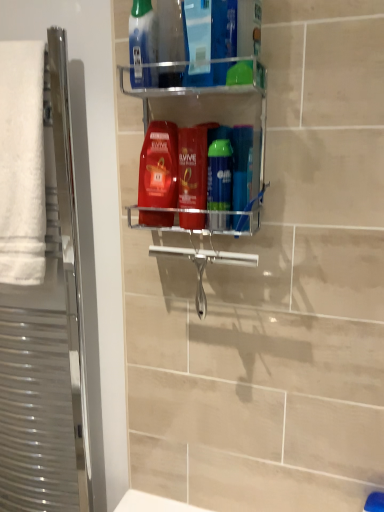
I want to click on silver metallic towel rack at left, so click(x=39, y=283).

Describe the element at coordinates (143, 44) in the screenshot. The image size is (384, 512). I see `translucent plastic mouthwash at upper center, marked as the 4th mouthwash in a right-to-left arrangement` at that location.

Identify the location of shiny red shampoo at center. The height and width of the screenshot is (512, 384). [x=159, y=166].

At what (x,y) coordinates should I click in order to perform the action: click on clear plastic shelf at center. Please return your answer as a coordinate pair (x, y). The height and width of the screenshot is (512, 384). Looking at the image, I should click on (207, 110).

Find the location of `silver metallic towel rack at left`. silver metallic towel rack at left is located at coordinates (39, 283).

Image resolution: width=384 pixels, height=512 pixels. What are the coordinates of `mouthwash that is the 2nd one when counting forward from the shiny red shampoo at center` in the screenshot? It's located at (219, 175).

Can you confirm if shiny red shampoo at center is positioned to the right of green glossy mouthwash at center, which appears as the 2th mouthwash when viewed from the right?

No, shiny red shampoo at center is not to the right of green glossy mouthwash at center, which appears as the 2th mouthwash when viewed from the right.

Is point (170, 206) closer to camera compared to point (230, 156)?

No.

At what (x,y) coordinates should I click in order to perform the action: click on shelf that appears above the shiny red shampoo at center (from the image's perspective). Please return your answer as a coordinate pair (x, y). The width and height of the screenshot is (384, 512). Looking at the image, I should click on (207, 110).

From a real-world perspective, is clear plastic shelf at center above or below shiny red shampoo at center?

clear plastic shelf at center is situated higher than shiny red shampoo at center in the real world.

Considering the sizes of objects clear plastic shelf at center and shiny red shampoo at center in the image provided, who is bigger, clear plastic shelf at center or shiny red shampoo at center?

clear plastic shelf at center.

Visually, is clear plastic shelf at center positioned to the left or to the right of shiny red shampoo at center?

Clearly, clear plastic shelf at center is on the right of shiny red shampoo at center in the image.

Is white soft towel at left inside or outside of clear plastic shelf at center?

white soft towel at left is spatially situated outside clear plastic shelf at center.

Consider the image. From a real-world perspective, is white soft towel at left above or below clear plastic shelf at center?

From a real-world perspective, white soft towel at left is physically below clear plastic shelf at center.

Between white soft towel at left and clear plastic shelf at center, which one has smaller size?

With smaller size is white soft towel at left.

From the image's perspective, is white soft towel at left located above or below clear plastic shelf at center?

white soft towel at left is above clear plastic shelf at center.

Would you say translucent plastic mouthwash at center, which appears as the third mouthwash when viewed from the right, is inside or outside shiny red shampoo at center?

translucent plastic mouthwash at center, which appears as the third mouthwash when viewed from the right, is not inside shiny red shampoo at center, it's outside.

From a real-world perspective, is translucent plastic mouthwash at center, the 2th mouthwash when ordered from left to right, below shiny red shampoo at center?

Yes, from a real-world perspective, translucent plastic mouthwash at center, the 2th mouthwash when ordered from left to right, is under shiny red shampoo at center.

Does translucent plastic mouthwash at center, the 2th mouthwash when ordered from left to right, have a lesser height compared to shiny red shampoo at center?

Indeed, translucent plastic mouthwash at center, the 2th mouthwash when ordered from left to right, has a lesser height compared to shiny red shampoo at center.

Are translucent plastic mouthwash at center, the 2th mouthwash when ordered from left to right, and shiny red shampoo at center making contact?

Yes, translucent plastic mouthwash at center, the 2th mouthwash when ordered from left to right, is touching shiny red shampoo at center.

Does point (250, 196) lie in front of point (137, 68)?

No, it is behind (137, 68).

Would you say blue plastic toothbrush at center, placed as the first mouthwash when sorted from right to left, is to the left or to the right of translucent plastic mouthwash at upper center, marked as the 4th mouthwash in a right-to-left arrangement, in the picture?

blue plastic toothbrush at center, placed as the first mouthwash when sorted from right to left, is positioned on translucent plastic mouthwash at upper center, marked as the 4th mouthwash in a right-to-left arrangement,'s right side.

Between blue plastic toothbrush at center, the 4th mouthwash from the left, and translucent plastic mouthwash at upper center, marked as the 4th mouthwash in a right-to-left arrangement, which one has larger size?

With larger size is translucent plastic mouthwash at upper center, marked as the 4th mouthwash in a right-to-left arrangement.

Which of these two, silver metallic towel rack at left or blue plastic toothbrush at center, placed as the first mouthwash when sorted from right to left, stands taller?

Standing taller between the two is silver metallic towel rack at left.

Identify the location of screen door below the blue plastic toothbrush at center, the 4th mouthwash from the left (from the image's perspective). Image resolution: width=384 pixels, height=512 pixels. (39, 283).

Which is more to the left, silver metallic towel rack at left or blue plastic toothbrush at center, placed as the first mouthwash when sorted from right to left?

silver metallic towel rack at left.

Is blue plastic toothbrush at center, placed as the first mouthwash when sorted from right to left, located within silver metallic towel rack at left?

Actually, blue plastic toothbrush at center, placed as the first mouthwash when sorted from right to left, is outside silver metallic towel rack at left.

Is translucent plastic mouthwash at upper center, placed as the first mouthwash when sorted from left to right, turned away from blue plastic toothbrush at center, placed as the first mouthwash when sorted from right to left?

translucent plastic mouthwash at upper center, placed as the first mouthwash when sorted from left to right, does not have its back to blue plastic toothbrush at center, placed as the first mouthwash when sorted from right to left.

From the image's perspective, is translucent plastic mouthwash at upper center, placed as the first mouthwash when sorted from left to right, over blue plastic toothbrush at center, placed as the first mouthwash when sorted from right to left?

Yes, from the image's perspective, translucent plastic mouthwash at upper center, placed as the first mouthwash when sorted from left to right, is on top of blue plastic toothbrush at center, placed as the first mouthwash when sorted from right to left.

Which point is more distant from viewer, (x=141, y=85) or (x=235, y=225)?

The point (x=235, y=225) is farther.

Between translucent plastic mouthwash at upper center, marked as the 4th mouthwash in a right-to-left arrangement, and blue plastic toothbrush at center, placed as the first mouthwash when sorted from right to left, which one has smaller size?

Smaller between the two is blue plastic toothbrush at center, placed as the first mouthwash when sorted from right to left.

Where is `cleaning product above the green glossy mouthwash at center, which appears as the 2th mouthwash when viewed from the right (from a real-world perspective)`? The height and width of the screenshot is (512, 384). cleaning product above the green glossy mouthwash at center, which appears as the 2th mouthwash when viewed from the right (from a real-world perspective) is located at coordinates (159, 166).

Where is `shelf lying on the right of shiny red shampoo at center`? The width and height of the screenshot is (384, 512). shelf lying on the right of shiny red shampoo at center is located at coordinates (207, 110).

From the image, which object appears to be farther from clear plastic shelf at center, shiny red shampoo at center or green glossy mouthwash at center, the 3th mouthwash viewed from the left?

green glossy mouthwash at center, the 3th mouthwash viewed from the left, is positioned further to the anchor clear plastic shelf at center.

Based on their spatial positions, is translucent plastic mouthwash at upper center, placed as the first mouthwash when sorted from left to right, or shiny red shampoo at center further from translucent plastic mouthwash at center, the 2th mouthwash when ordered from left to right?

translucent plastic mouthwash at upper center, placed as the first mouthwash when sorted from left to right, is further to translucent plastic mouthwash at center, the 2th mouthwash when ordered from left to right.

Based on the photo, looking at the image, which one is located closer to translucent plastic mouthwash at upper center, marked as the 4th mouthwash in a right-to-left arrangement, clear plastic shelf at center or blue plastic toothbrush at center, placed as the first mouthwash when sorted from right to left?

clear plastic shelf at center is positioned closer to the anchor translucent plastic mouthwash at upper center, marked as the 4th mouthwash in a right-to-left arrangement.

From the image, which object appears to be nearer to translucent plastic mouthwash at center, which appears as the third mouthwash when viewed from the right, green glossy mouthwash at center, which appears as the 2th mouthwash when viewed from the right, or blue plastic toothbrush at center, the 4th mouthwash from the left?

green glossy mouthwash at center, which appears as the 2th mouthwash when viewed from the right, is closer to translucent plastic mouthwash at center, which appears as the third mouthwash when viewed from the right.

Estimate the real-world distances between objects in this image. Which object is further from green glossy mouthwash at center, the 3th mouthwash viewed from the left, silver metallic towel rack at left or translucent plastic mouthwash at upper center, marked as the 4th mouthwash in a right-to-left arrangement?

Based on the image, silver metallic towel rack at left appears to be further to green glossy mouthwash at center, the 3th mouthwash viewed from the left.

Based on their spatial positions, is translucent plastic mouthwash at upper center, marked as the 4th mouthwash in a right-to-left arrangement, or blue plastic toothbrush at center, placed as the first mouthwash when sorted from right to left, further from green glossy mouthwash at center, which appears as the 2th mouthwash when viewed from the right?

translucent plastic mouthwash at upper center, marked as the 4th mouthwash in a right-to-left arrangement, is further to green glossy mouthwash at center, which appears as the 2th mouthwash when viewed from the right.

Considering their positions, is shiny red shampoo at center positioned further to silver metallic towel rack at left than green glossy mouthwash at center, which appears as the 2th mouthwash when viewed from the right?

The object further to silver metallic towel rack at left is green glossy mouthwash at center, which appears as the 2th mouthwash when viewed from the right.

Which object lies further to the anchor point white soft towel at left, translucent plastic mouthwash at center, which appears as the third mouthwash when viewed from the right, or translucent plastic mouthwash at upper center, marked as the 4th mouthwash in a right-to-left arrangement?

Based on the image, translucent plastic mouthwash at center, which appears as the third mouthwash when viewed from the right, appears to be further to white soft towel at left.

You are a GUI agent. You are given a task and a screenshot of the screen. Output one action in this format:
    pyautogui.click(x=<x>, y=<y>)
    Task: Click on the shelf between translucent plastic mouthwash at upper center, marked as the 4th mouthwash in a right-to-left arrangement, and blue plastic toothbrush at center, placed as the first mouthwash when sorted from right to left, vertically
    Image resolution: width=384 pixels, height=512 pixels.
    Given the screenshot: What is the action you would take?
    pyautogui.click(x=207, y=110)

In order to click on shelf located between shiny red shampoo at center and green glossy mouthwash at center, which appears as the 2th mouthwash when viewed from the right, in the left-right direction in this screenshot , I will do pyautogui.click(x=207, y=110).

The image size is (384, 512). In order to click on shelf located between shiny red shampoo at center and blue plastic toothbrush at center, the 4th mouthwash from the left, in the left-right direction in this screenshot , I will do `click(207, 110)`.

Identify the location of shelf between translucent plastic mouthwash at center, the 2th mouthwash when ordered from left to right, and blue plastic toothbrush at center, the 4th mouthwash from the left. (207, 110).